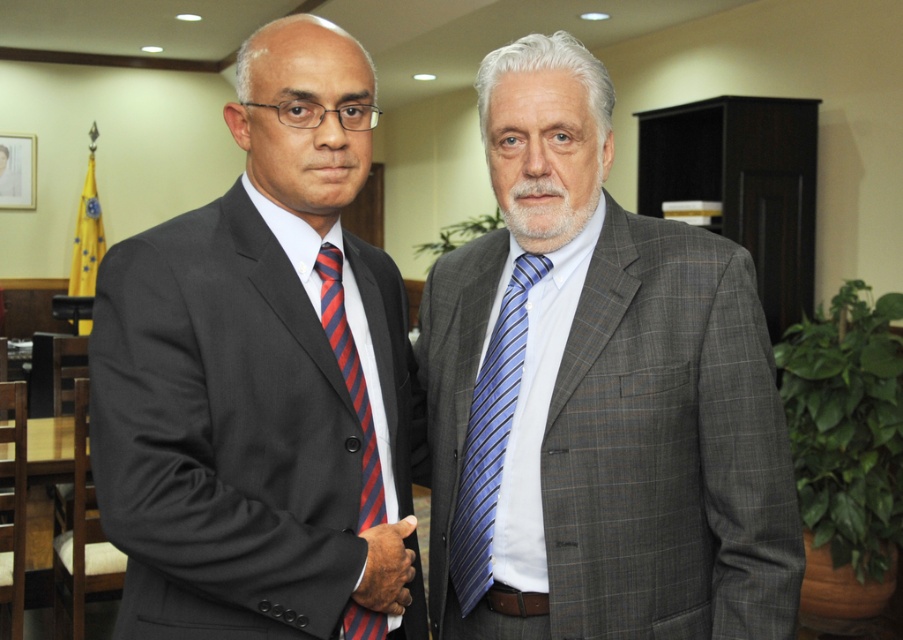
Is gray checkered suit at right in front of red striped tie at left?

No, it is not.

Between point (684, 314) and point (355, 378), which one is positioned in front?

Point (355, 378) is more forward.

I want to click on gray checkered suit at right, so click(597, 396).

Between point (133, 525) and point (452, 544), which one is positioned in front?

Point (133, 525)

Between point (103, 333) and point (489, 467), which one is positioned behind?

The point (489, 467) is behind.

Find the location of a particular element. The height and width of the screenshot is (640, 903). matte black suit at left is located at coordinates (263, 380).

The width and height of the screenshot is (903, 640). What do you see at coordinates (597, 396) in the screenshot?
I see `gray checkered suit at right` at bounding box center [597, 396].

How much distance is there between gray checkered suit at right and matte black suit at left?

gray checkered suit at right and matte black suit at left are 12.49 inches apart from each other.

Between point (712, 531) and point (334, 64), which one is positioned behind?

Positioned behind is point (712, 531).

At what (x,y) coordinates should I click in order to perform the action: click on gray checkered suit at right. Please return your answer as a coordinate pair (x, y). Looking at the image, I should click on [x=597, y=396].